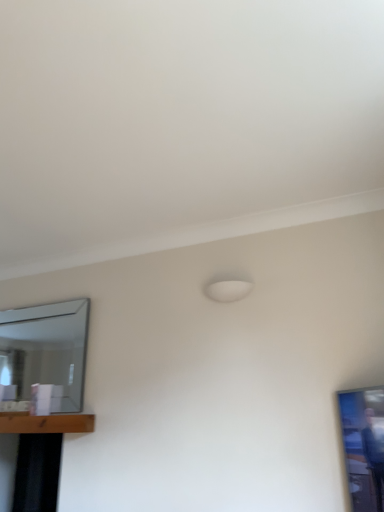
Question: Is brown wooden table at lower left, which appears as the first table when viewed from the top, at the right side of black matte table at lower left, the 1th table ordered from the bottom?

Choices:
 (A) no
 (B) yes

Answer: (B)

Question: From the image's perspective, does brown wooden table at lower left, which is the second table from bottom to top, appear higher than black matte table at lower left, the 1th table ordered from the bottom?

Choices:
 (A) yes
 (B) no

Answer: (A)

Question: Could you tell me if brown wooden table at lower left, which appears as the first table when viewed from the top, is turned towards black matte table at lower left, the 1th table ordered from the bottom?

Choices:
 (A) no
 (B) yes

Answer: (A)

Question: Would you consider brown wooden table at lower left, which appears as the first table when viewed from the top, to be distant from black matte table at lower left, positioned as the second table in top-to-bottom order?

Choices:
 (A) no
 (B) yes

Answer: (A)

Question: Is brown wooden table at lower left, which appears as the first table when viewed from the top, looking in the opposite direction of black matte table at lower left, the 1th table ordered from the bottom?

Choices:
 (A) yes
 (B) no

Answer: (B)

Question: Is point click(29, 464) closer or farther from the camera than point click(44, 432)?

Choices:
 (A) farther
 (B) closer

Answer: (A)

Question: Considering the positions of black matte table at lower left, the 1th table ordered from the bottom, and brown wooden table at lower left, which is the second table from bottom to top, in the image, is black matte table at lower left, the 1th table ordered from the bottom, wider or thinner than brown wooden table at lower left, which is the second table from bottom to top,?

Choices:
 (A) wide
 (B) thin

Answer: (A)

Question: From a real-world perspective, is black matte table at lower left, the 1th table ordered from the bottom, physically located above or below brown wooden table at lower left, which appears as the first table when viewed from the top?

Choices:
 (A) above
 (B) below

Answer: (B)

Question: Based on their positions, is black matte table at lower left, the 1th table ordered from the bottom, located to the left or right of brown wooden table at lower left, which appears as the first table when viewed from the top?

Choices:
 (A) right
 (B) left

Answer: (B)

Question: Is point (91, 423) closer or farther from the camera than point (3, 327)?

Choices:
 (A) farther
 (B) closer

Answer: (B)

Question: From a real-world perspective, is black matte table at lower left, positioned as the second table in top-to-bottom order, above or below clear glass mirror at left?

Choices:
 (A) above
 (B) below

Answer: (B)

Question: Is black matte table at lower left, the 1th table ordered from the bottom, bigger or smaller than clear glass mirror at left?

Choices:
 (A) small
 (B) big

Answer: (B)

Question: From the image's perspective, is black matte table at lower left, the 1th table ordered from the bottom, located above or below clear glass mirror at left?

Choices:
 (A) below
 (B) above

Answer: (A)

Question: In terms of height, does brown wooden table at lower left, which is the second table from bottom to top, look taller or shorter compared to clear glass mirror at left?

Choices:
 (A) tall
 (B) short

Answer: (B)

Question: Would you say brown wooden table at lower left, which appears as the first table when viewed from the top, is inside or outside clear glass mirror at left?

Choices:
 (A) inside
 (B) outside

Answer: (B)